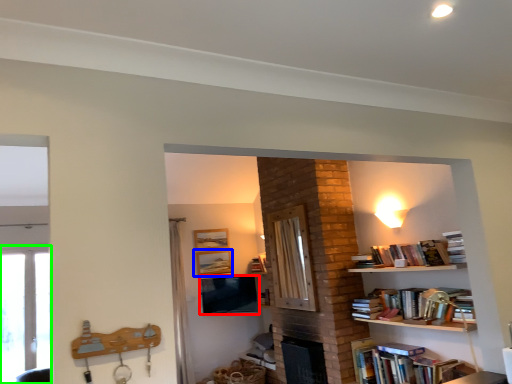
Question: Based on their relative distances, which object is farther from television (highlighted by a red box)? Choose from picture frame (highlighted by a blue box) and window (highlighted by a green box).

Choices:
 (A) picture frame
 (B) window

Answer: (B)